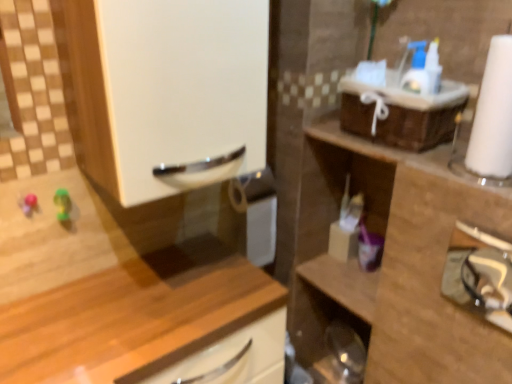
Question: Is white glossy cabinet handle at upper left next to wooden cabinet at lower left, marked as the first cabinetry in a left-to-right arrangement?

Choices:
 (A) no
 (B) yes

Answer: (A)

Question: From a real-world perspective, is white glossy cabinet handle at upper left located higher than wooden cabinet at lower left, marked as the first cabinetry in a left-to-right arrangement?

Choices:
 (A) no
 (B) yes

Answer: (B)

Question: Is white glossy cabinet handle at upper left positioned far away from wooden cabinet at lower left, marked as the first cabinetry in a left-to-right arrangement?

Choices:
 (A) yes
 (B) no

Answer: (B)

Question: Does white glossy cabinet handle at upper left have a greater height compared to wooden cabinet at lower left, the second cabinetry in the right-to-left sequence?

Choices:
 (A) no
 (B) yes

Answer: (A)

Question: Considering the relative positions of white glossy cabinet handle at upper left and wooden cabinet at lower left, marked as the first cabinetry in a left-to-right arrangement, in the image provided, is white glossy cabinet handle at upper left in front of wooden cabinet at lower left, marked as the first cabinetry in a left-to-right arrangement,?

Choices:
 (A) no
 (B) yes

Answer: (A)

Question: Could you tell me if white glossy cabinet handle at upper left is turned towards wooden cabinet at lower left, marked as the first cabinetry in a left-to-right arrangement?

Choices:
 (A) no
 (B) yes

Answer: (A)

Question: Can you confirm if purple plastic toothbrush at center-right, which is counted as the second toiletry, starting from the left, is thinner than wooden cabinet at lower left, marked as the first cabinetry in a left-to-right arrangement?

Choices:
 (A) yes
 (B) no

Answer: (A)

Question: From a real-world perspective, is purple plastic toothbrush at center-right, which is counted as the second toiletry, starting from the left, on top of wooden cabinet at lower left, the second cabinetry in the right-to-left sequence?

Choices:
 (A) yes
 (B) no

Answer: (A)

Question: From a real-world perspective, is purple plastic toothbrush at center-right, arranged as the first toiletry when viewed from the right, physically below wooden cabinet at lower left, the second cabinetry in the right-to-left sequence?

Choices:
 (A) no
 (B) yes

Answer: (A)

Question: Is purple plastic toothbrush at center-right, which is counted as the second toiletry, starting from the left, facing away from wooden cabinet at lower left, marked as the first cabinetry in a left-to-right arrangement?

Choices:
 (A) yes
 (B) no

Answer: (B)

Question: Can you confirm if purple plastic toothbrush at center-right, arranged as the first toiletry when viewed from the right, is taller than wooden cabinet at lower left, the second cabinetry in the right-to-left sequence?

Choices:
 (A) no
 (B) yes

Answer: (A)

Question: Does purple plastic toothbrush at center-right, which is counted as the second toiletry, starting from the left, appear on the right side of wooden cabinet at lower left, the second cabinetry in the right-to-left sequence?

Choices:
 (A) yes
 (B) no

Answer: (A)

Question: Could you tell me if translucent plastic container at center-right, which is counted as the second toiletry, starting from the right, is turned towards wooden cabinet at right, which is counted as the first cabinetry, starting from the right?

Choices:
 (A) no
 (B) yes

Answer: (B)